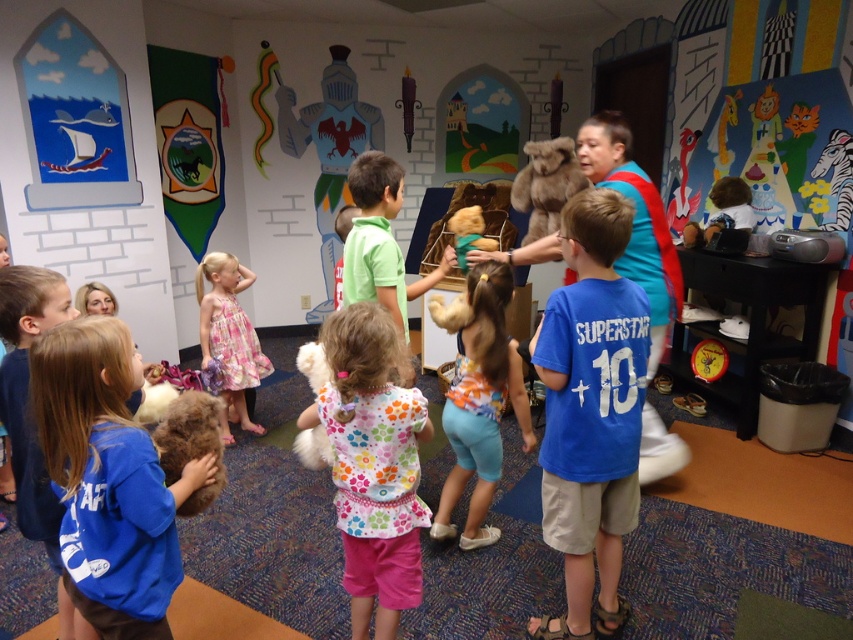
Question: Does fluffy brown teddy bear at center have a greater width compared to gray metallic knight at center?

Choices:
 (A) no
 (B) yes

Answer: (A)

Question: Is blue cotton shirt at center above fluffy brown teddy bear at center?

Choices:
 (A) no
 (B) yes

Answer: (A)

Question: Which point is farther to the camera?

Choices:
 (A) gray metallic knight at center
 (B) floral dress at center

Answer: (A)

Question: Which point is closer to the camera?

Choices:
 (A) gray metallic knight at center
 (B) fluffy brown teddy bear at center
 (C) green cotton shirt at center
 (D) fuzzy brown teddy bear at lower left

Answer: (D)

Question: Which of the following is the closest to the observer?

Choices:
 (A) green cotton shirt at center
 (B) blue cotton shirt at center
 (C) floral dress at center
 (D) fluffy brown teddy bear at center

Answer: (A)

Question: Where is soft brown teddy bear at lower left located in relation to fuzzy brown teddy bear at lower left in the image?

Choices:
 (A) left
 (B) right

Answer: (A)